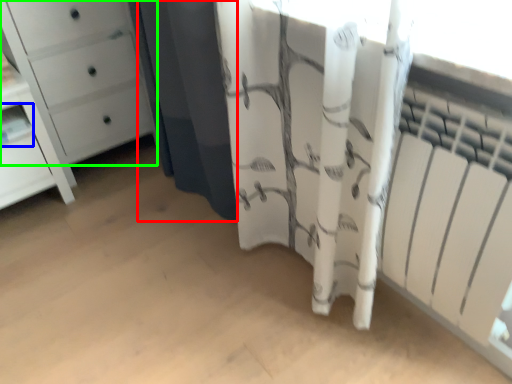
Question: Which object is positioned farthest from shower curtain (highlighted by a red box)? Select from shelf (highlighted by a blue box) and chest of drawers (highlighted by a green box).

Choices:
 (A) shelf
 (B) chest of drawers

Answer: (A)